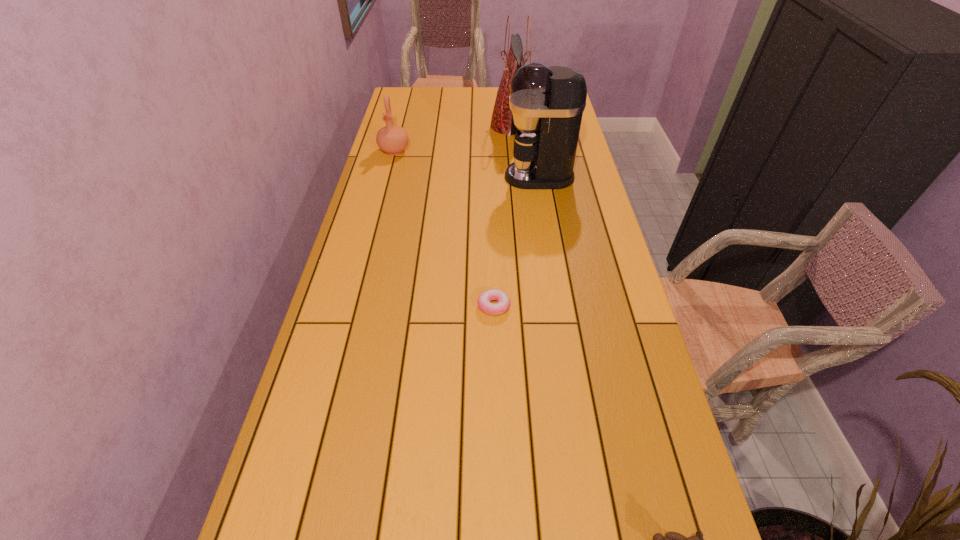
Identify the location of vacant region located 0.160m on the spout of the leftmost object. This screenshot has width=960, height=540. (386, 184).

Locate an element on the screen. The height and width of the screenshot is (540, 960). vacant space located 0.350m on the back of the second nearest object is located at coordinates (492, 214).

Where is `object that is at the far edge`? Image resolution: width=960 pixels, height=540 pixels. object that is at the far edge is located at coordinates (502, 121).

Where is `object that is at the left edge`? object that is at the left edge is located at coordinates (392, 139).

Locate an element on the screen. The width and height of the screenshot is (960, 540). object located in the right edge section of the desktop is located at coordinates (547, 103).

You are a GUI agent. You are given a task and a screenshot of the screen. Output one action in this format:
    pyautogui.click(x=<x>, y=<y>)
    Task: Click on the vacant space at the far edge of the desktop
    Image resolution: width=960 pixels, height=540 pixels.
    Given the screenshot: What is the action you would take?
    pyautogui.click(x=447, y=104)

This screenshot has width=960, height=540. I want to click on vacant area at the left edge of the desktop, so click(x=410, y=155).

The image size is (960, 540). In the image, there is a desktop. Identify the location of vacant space at the right edge. (644, 445).

Image resolution: width=960 pixels, height=540 pixels. I want to click on free space at the far left corner of the desktop, so click(410, 102).

The height and width of the screenshot is (540, 960). I want to click on vacant space in between the second nearest object and the leftmost object, so click(444, 228).